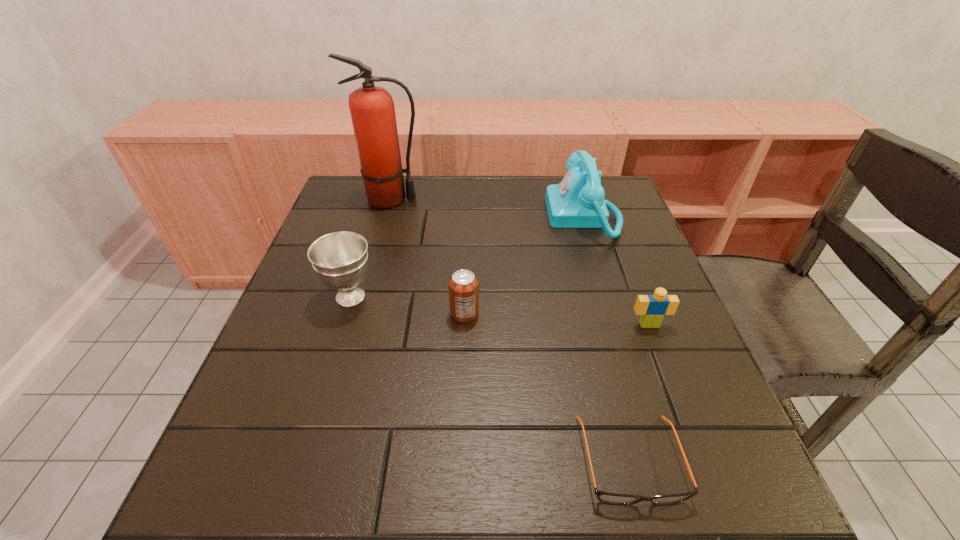
Identify the location of blank area at the near left corner. This screenshot has height=540, width=960. point(232,493).

Where is `free location at the near right corner of the desktop`? The height and width of the screenshot is (540, 960). free location at the near right corner of the desktop is located at coordinates (732, 511).

Where is `free space between the Lego and the shortest object`? The width and height of the screenshot is (960, 540). free space between the Lego and the shortest object is located at coordinates (639, 392).

I want to click on blank region between the spectacles and the fire extinguisher, so click(511, 330).

Where is `free space between the fourth object from right to left and the telephone`? The height and width of the screenshot is (540, 960). free space between the fourth object from right to left and the telephone is located at coordinates (524, 265).

Image resolution: width=960 pixels, height=540 pixels. Find the location of `free area in between the chalice and the Lego`. free area in between the chalice and the Lego is located at coordinates (500, 310).

Locate an element on the screen. The height and width of the screenshot is (540, 960). free spot between the nearest object and the fourth object from right to left is located at coordinates (547, 387).

Locate an element on the screen. vacant space in between the spectacles and the Lego is located at coordinates (639, 392).

The image size is (960, 540). I want to click on vacant area that lies between the shortest object and the tallest object, so click(511, 330).

Identify the location of empty space between the Lego and the telephone. [x=616, y=271].